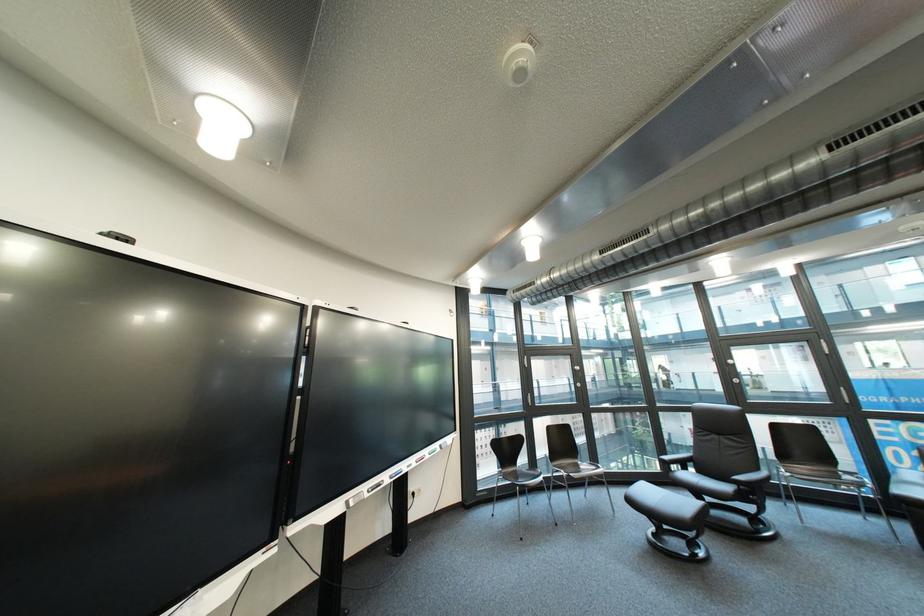
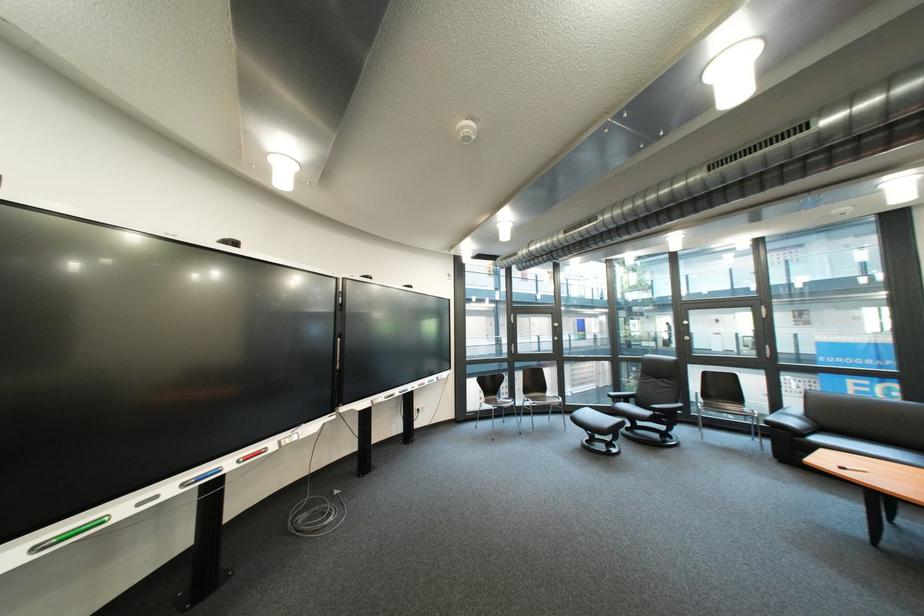
Locate, in the second image, the point that corresponds to pixel 756 488 in the first image.

(670, 415)